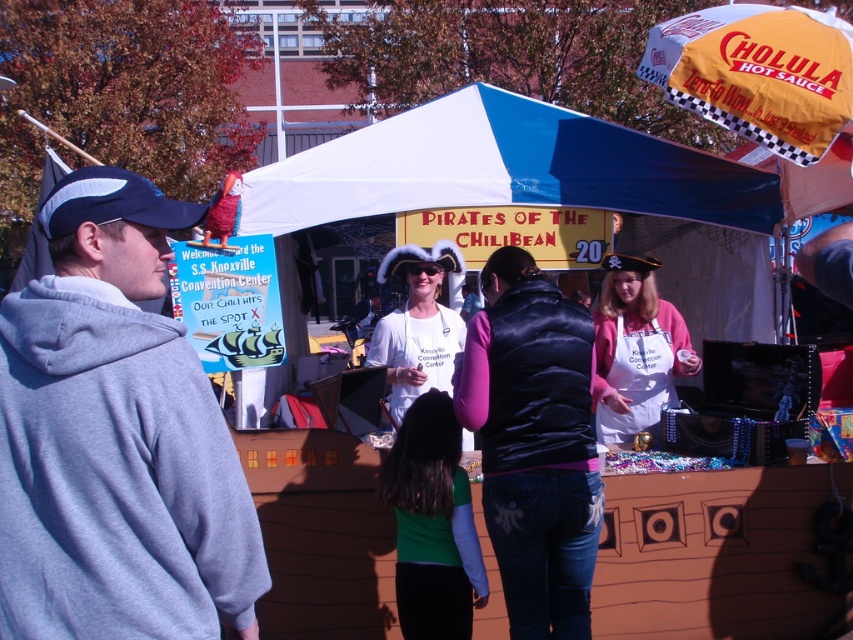
Can you confirm if gray fleece hoodie at left is positioned to the right of black puffy vest at center?

No, gray fleece hoodie at left is not to the right of black puffy vest at center.

Does point (119, 356) come farther from viewer compared to point (534, 266)?

No, (119, 356) is in front of (534, 266).

Find the location of a particular element. The width and height of the screenshot is (853, 640). gray fleece hoodie at left is located at coordinates pos(115,440).

What do you see at coordinates (534, 444) in the screenshot? The width and height of the screenshot is (853, 640). I see `black puffy vest at center` at bounding box center [534, 444].

Between black puffy vest at center and yellow fabric umbrella at upper right, which one is positioned higher?

yellow fabric umbrella at upper right is above.

This screenshot has width=853, height=640. Describe the element at coordinates (534, 444) in the screenshot. I see `black puffy vest at center` at that location.

Identify the location of black puffy vest at center. (534, 444).

Is point (709, 179) closer to viewer compared to point (650, 58)?

Yes, it is in front of point (650, 58).

Does blue fabric canopy at upper center have a smaller size compared to yellow fabric umbrella at upper right?

No, blue fabric canopy at upper center is not smaller than yellow fabric umbrella at upper right.

What do you see at coordinates (503, 168) in the screenshot?
I see `blue fabric canopy at upper center` at bounding box center [503, 168].

Where is `blue fabric canopy at upper center`? Image resolution: width=853 pixels, height=640 pixels. blue fabric canopy at upper center is located at coordinates (503, 168).